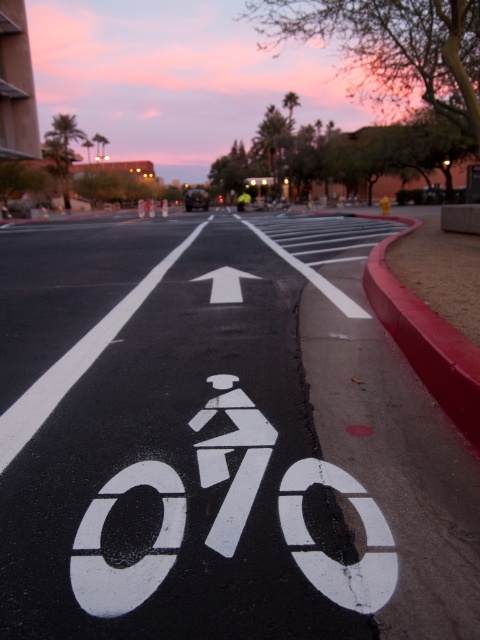
Measure the distance between white painted bike lane at center and camera.

The distance of white painted bike lane at center from camera is 7.34 feet.

The width and height of the screenshot is (480, 640). Describe the element at coordinates (176, 442) in the screenshot. I see `white painted bike lane at center` at that location.

Is point (290, 435) positioned in front of point (237, 499)?

That is False.

This screenshot has width=480, height=640. What are the coordinates of `white painted bike lane at center` in the screenshot? It's located at (176, 442).

Which is above, white painted bike lane at center or red rubber curb at right?

red rubber curb at right

Is white painted bike lane at center shorter than red rubber curb at right?

Yes, white painted bike lane at center is shorter than red rubber curb at right.

Who is more forward, (x=45, y=440) or (x=432, y=368)?

Point (x=45, y=440) is more forward.

The height and width of the screenshot is (640, 480). What are the coordinates of `white painted bike lane at center` in the screenshot? It's located at (176, 442).

Does red rubber curb at right have a greater height compared to white matte arrow at center?

Indeed, red rubber curb at right has a greater height compared to white matte arrow at center.

Between point (477, 428) and point (217, 273), which one is positioned behind?

The point (217, 273) is more distant.

Where is `red rubber curb at right`? This screenshot has width=480, height=640. red rubber curb at right is located at coordinates 425,339.